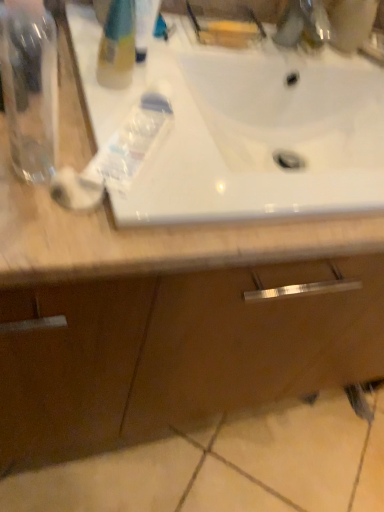
You are a GUI agent. You are given a task and a screenshot of the screen. Output one action in this format:
    pyautogui.click(x=<x>, y=<y>)
    Task: Click on the vacant area that is in front of metallic faucet at upper right
    The height and width of the screenshot is (512, 384).
    Given the screenshot: What is the action you would take?
    pyautogui.click(x=276, y=63)